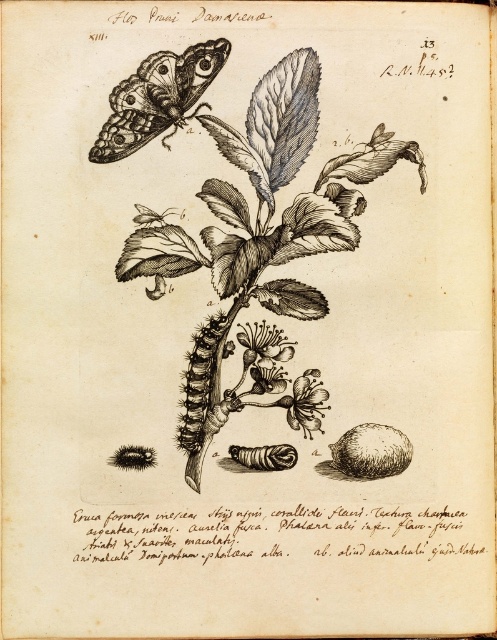
You are an entomologist studying the life cycle of the caterpillar shown in the image. You need to locate the shiny black butterfly at upper left. Where exactly is it positioned in the image?

The shiny black butterfly at upper left is positioned at point (158, 97).

You are a botanist examining the illustration. You notice the dark brown fuzzy caterpillar at center and the smooth white flower at center. Which object is closer to the viewer in the illustration?

The dark brown fuzzy caterpillar at center is closer to the viewer than the smooth white flower at center because it is positioned in front of it.